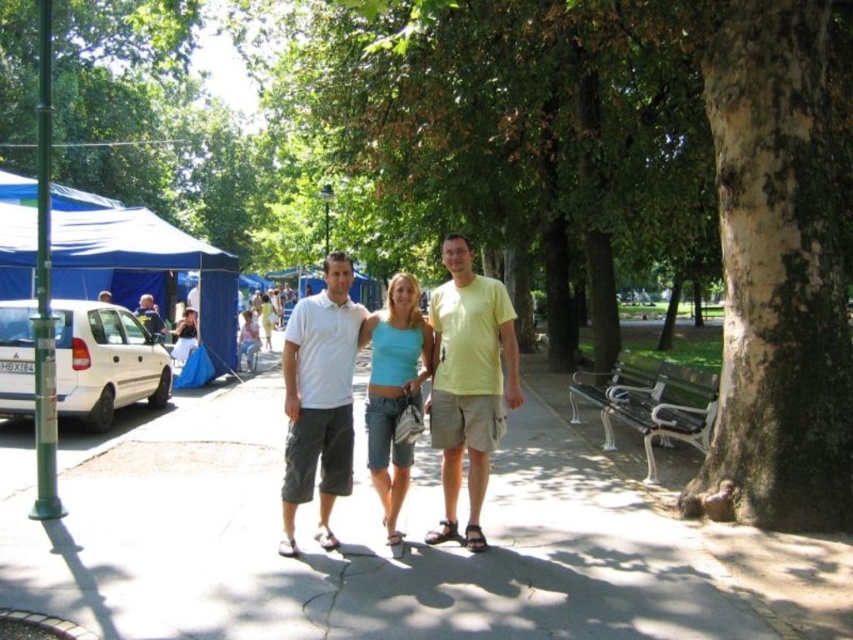
Question: Can you confirm if smooth bark tree trunk at right is positioned below light blue shirt at left?

Choices:
 (A) no
 (B) yes

Answer: (A)

Question: Can you confirm if smooth bark tree trunk at right is positioned above blue fabric canopy at left?

Choices:
 (A) no
 (B) yes

Answer: (A)

Question: Which point is closer to the camera taking this photo?

Choices:
 (A) (154, 305)
 (B) (286, 452)
 (C) (395, 518)
 (D) (202, 321)

Answer: (B)

Question: Which object is farther from the camera taking this photo?

Choices:
 (A) blue fabric tent at left
 (B) light blue shirt at left

Answer: (B)

Question: Which object appears farthest from the camera in this image?

Choices:
 (A) blue fabric tent at left
 (B) smooth bark tree trunk at right
 (C) light blue denim shorts at center
 (D) matte blue tank top at center

Answer: (D)

Question: Can you confirm if blue fabric tent at left is positioned above matte blue tank top at center?

Choices:
 (A) no
 (B) yes

Answer: (B)